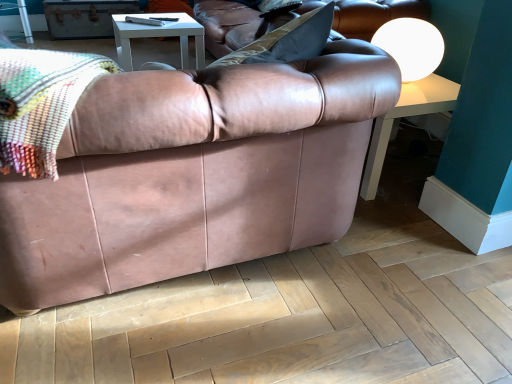
Question: Is white matte sphere at upper right to the left of light brown wood at lower center from the viewer's perspective?

Choices:
 (A) no
 (B) yes

Answer: (A)

Question: Considering the relative sizes of white matte sphere at upper right and light brown wood at lower center in the image provided, is white matte sphere at upper right bigger than light brown wood at lower center?

Choices:
 (A) no
 (B) yes

Answer: (B)

Question: Considering the relative sizes of white matte sphere at upper right and light brown wood at lower center in the image provided, is white matte sphere at upper right thinner than light brown wood at lower center?

Choices:
 (A) no
 (B) yes

Answer: (A)

Question: Does white matte sphere at upper right come behind light brown wood at lower center?

Choices:
 (A) yes
 (B) no

Answer: (A)

Question: Is white matte sphere at upper right shorter than light brown wood at lower center?

Choices:
 (A) no
 (B) yes

Answer: (A)

Question: From their relative heights in the image, would you say matte brown leather couch at center is taller or shorter than white matte sphere at upper right?

Choices:
 (A) tall
 (B) short

Answer: (A)

Question: From the image's perspective, relative to white matte sphere at upper right, is matte brown leather couch at center above or below?

Choices:
 (A) above
 (B) below

Answer: (B)

Question: Is matte brown leather couch at center wider or thinner than white matte sphere at upper right?

Choices:
 (A) wide
 (B) thin

Answer: (A)

Question: Considering the relative positions of matte brown leather couch at center and white matte sphere at upper right in the image provided, is matte brown leather couch at center to the left or to the right of white matte sphere at upper right?

Choices:
 (A) left
 (B) right

Answer: (A)

Question: Is white matte sphere at upper right situated inside multicolored woven blanket at upper left or outside?

Choices:
 (A) inside
 (B) outside

Answer: (B)

Question: From a real-world perspective, is white matte sphere at upper right physically located above or below multicolored woven blanket at upper left?

Choices:
 (A) below
 (B) above

Answer: (A)

Question: Would you say white matte sphere at upper right is to the left or to the right of multicolored woven blanket at upper left in the picture?

Choices:
 (A) left
 (B) right

Answer: (B)

Question: Considering the positions of point (398, 52) and point (57, 127), is point (398, 52) closer or farther from the camera than point (57, 127)?

Choices:
 (A) closer
 (B) farther

Answer: (B)

Question: Is point (29, 82) positioned closer to the camera than point (418, 46)?

Choices:
 (A) farther
 (B) closer

Answer: (B)

Question: In terms of width, does multicolored woven blanket at upper left look wider or thinner when compared to white matte sphere at upper right?

Choices:
 (A) wide
 (B) thin

Answer: (A)